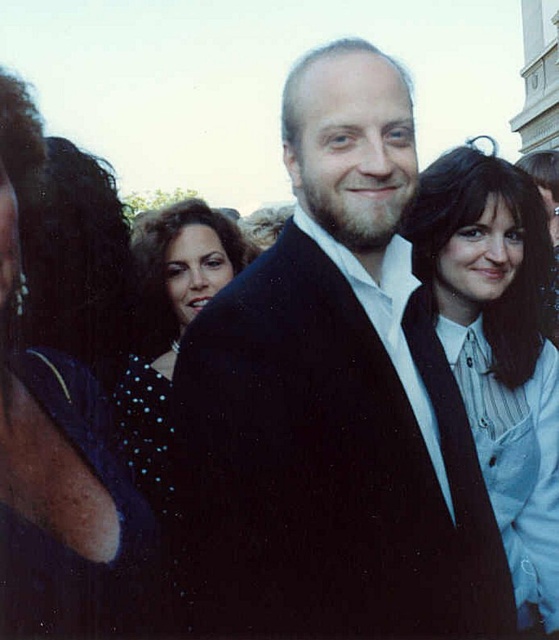
Question: Does light blue shirt at center have a larger size compared to sparkly blue dress at center?

Choices:
 (A) yes
 (B) no

Answer: (B)

Question: Which of the following is the farthest from the observer?

Choices:
 (A) dark blue dotted dress at left
 (B) black matte suit at center
 (C) light blue shirt at center
 (D) sparkly blue dress at center

Answer: (D)

Question: Is the position of black matte suit at center less distant than that of dark blue dotted dress at left?

Choices:
 (A) no
 (B) yes

Answer: (A)

Question: Which of the following is the closest to the observer?

Choices:
 (A) (443, 392)
 (B) (499, 244)

Answer: (A)

Question: Where is dark blue dotted dress at left located in relation to light blue shirt at center in the image?

Choices:
 (A) above
 (B) below

Answer: (A)

Question: Which point is farther to the camera?

Choices:
 (A) (338, 244)
 (B) (159, 442)

Answer: (B)